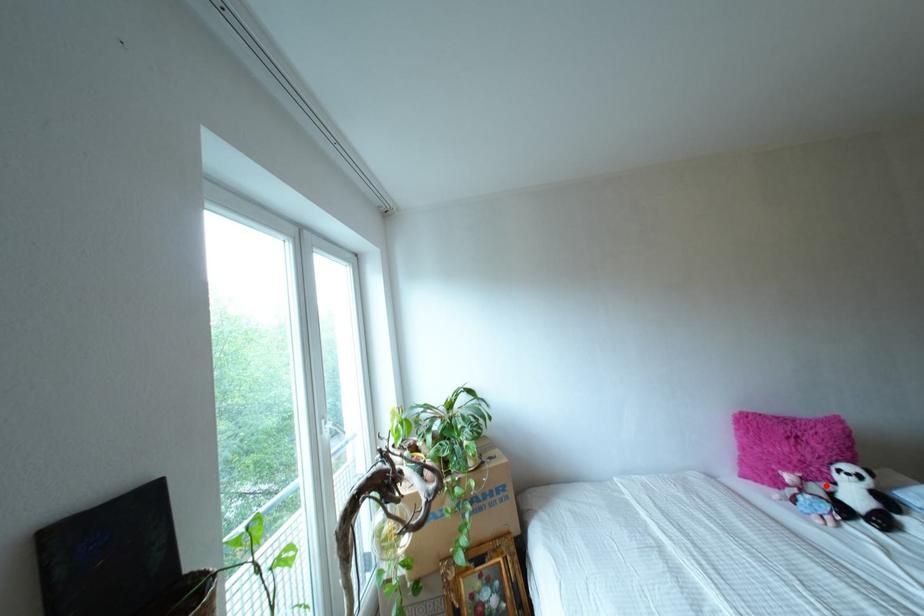
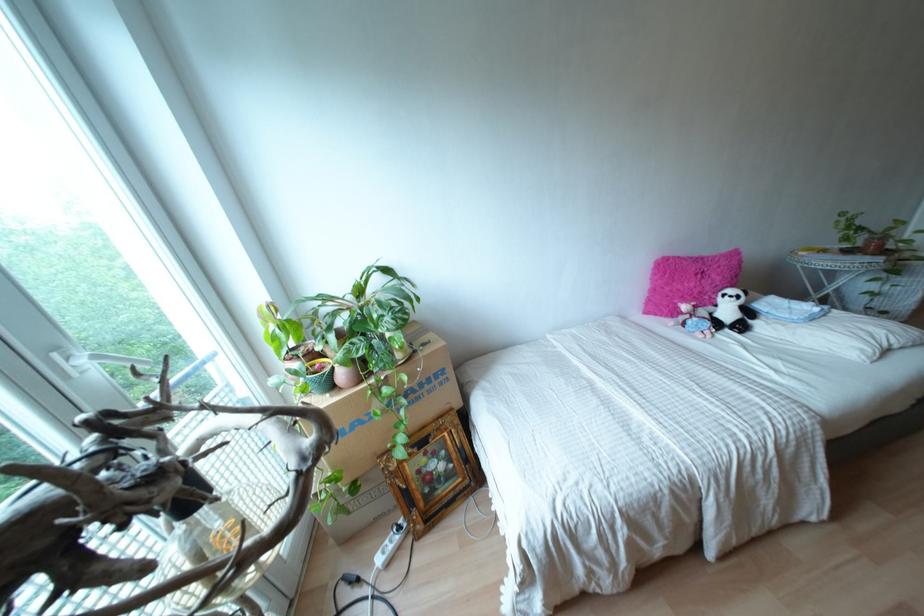
Question: I am providing you with two images of the same scene from different viewpoints. In image1, a red point is highlighted. Considering the same 3D point in image2, which of the following is correct?

Choices:
 (A) It is closer
 (B) It is farther

Answer: (B)